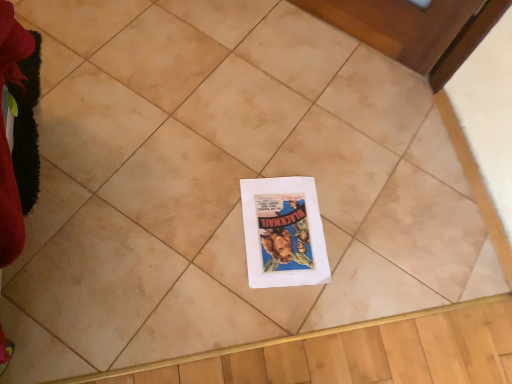
Identify the location of vacant area that lies to the right of white paper flyer at center. (366, 250).